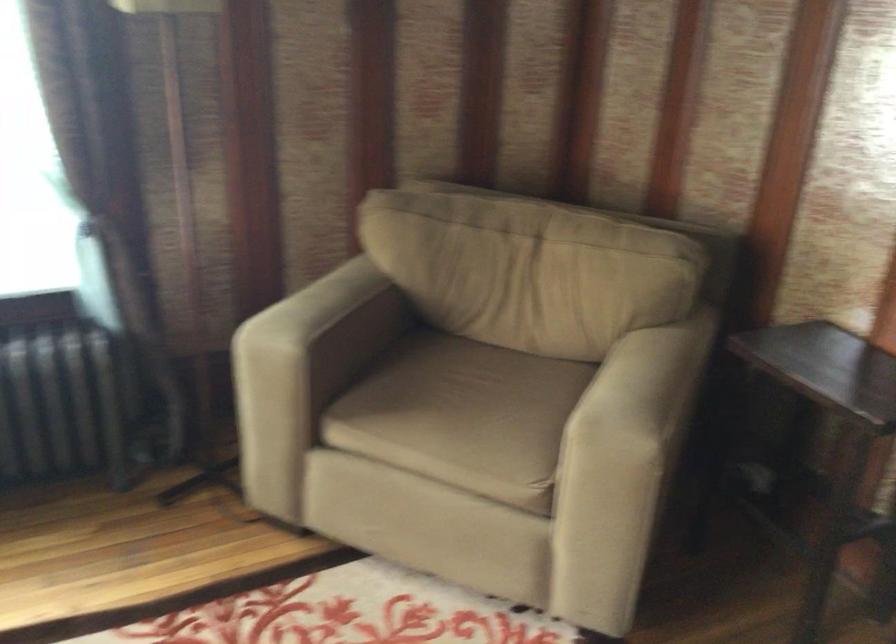
I want to click on chair sitting surface, so click(458, 413).